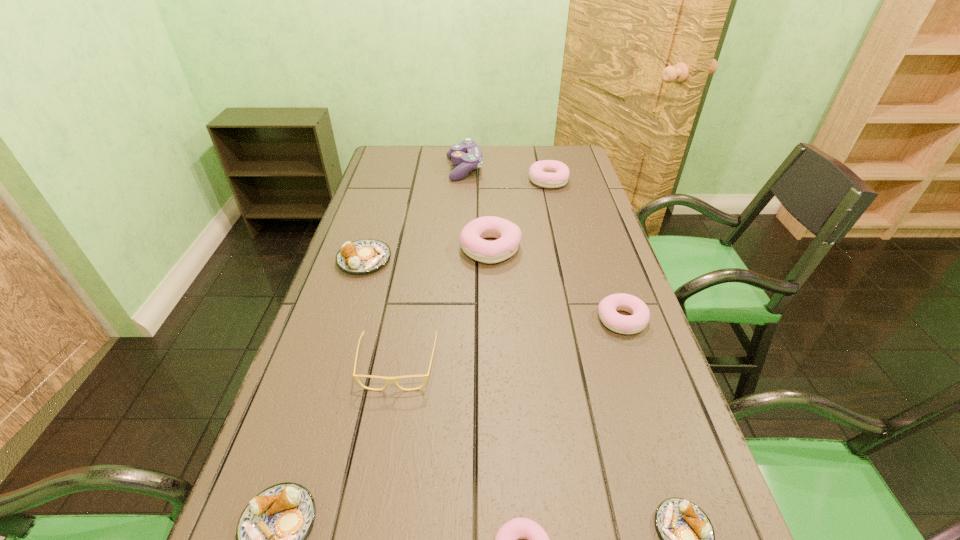
Identify which pastry is located as the nearest to the second smallest brown pastry. Please provide its 2D coordinates. Your answer should be formatted as a tuple, i.e. [(x, y)], where the tuple contains the x and y coordinates of a point satisfying the conditions above.

[(506, 539)]

Identify the location of pink pastry that is the third nearest to the fifth farthest object. This screenshot has width=960, height=540. (547, 173).

Point out which pink pastry is positioned as the fourth nearest to the fourth nearest object. Please provide its 2D coordinates. Your answer should be formatted as a tuple, i.e. [(x, y)], where the tuple contains the x and y coordinates of a point satisfying the conditions above.

[(547, 173)]

Where is `the closest brown pastry to the smallest pink pastry`? the closest brown pastry to the smallest pink pastry is located at coordinates (688, 539).

Where is `brown pastry that can be found as the second closest to the smallest brown pastry`? brown pastry that can be found as the second closest to the smallest brown pastry is located at coordinates (366, 255).

In order to click on free space that satisfies the following two spatial constraints: 1. on the front side of the second biggest pink pastry; 2. on the right side of the purple control in this screenshot , I will do `click(464, 180)`.